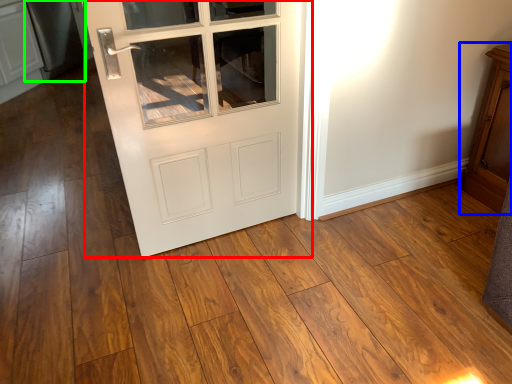
Question: Which object is the closest to the door (highlighted by a red box)? Choose among these: dresser (highlighted by a blue box) or appliance (highlighted by a green box).

Choices:
 (A) dresser
 (B) appliance

Answer: (A)